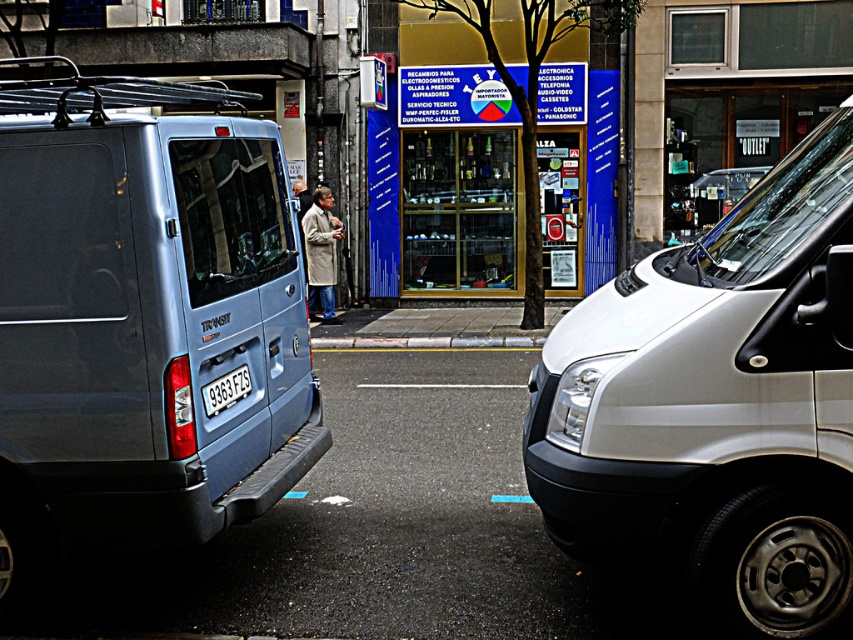
Question: Is white metallic van at right positioned before gray concrete curb at center?

Choices:
 (A) yes
 (B) no

Answer: (A)

Question: Is white metallic van at right bigger than white plastic license plate at center?

Choices:
 (A) yes
 (B) no

Answer: (A)

Question: Based on their relative distances, which object is nearer to the white plastic license plate at center?

Choices:
 (A) matte blue van at left
 (B) light brown leather jacket at center
 (C) light brown coat at center
 (D) white metallic van at right

Answer: (A)

Question: Which point is closer to the camera?

Choices:
 (A) white metallic van at right
 (B) white plastic license plate at center

Answer: (A)

Question: Which object appears closest to the camera in this image?

Choices:
 (A) light brown leather jacket at center
 (B) matte blue van at left

Answer: (B)

Question: Is matte blue van at left to the right of white plastic license plate at center from the viewer's perspective?

Choices:
 (A) yes
 (B) no

Answer: (B)